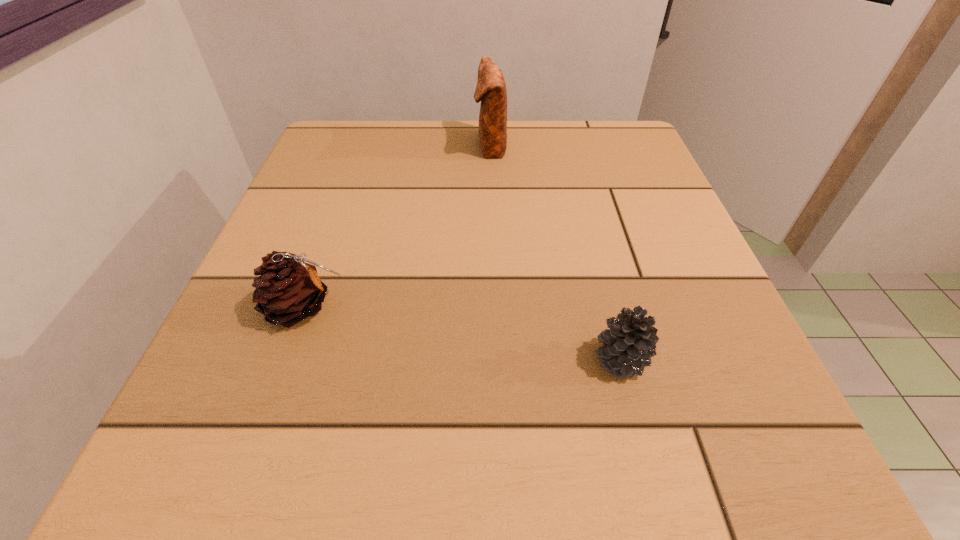
This screenshot has width=960, height=540. I want to click on vacant space located on the back of the nearer pinecone, so (575, 187).

This screenshot has height=540, width=960. Find the location of `object that is at the far edge`. object that is at the far edge is located at coordinates (491, 90).

The height and width of the screenshot is (540, 960). I want to click on object at the left edge, so click(289, 290).

Identify the location of object present at the right edge. (629, 344).

Find the location of `free space at the far edge of the desktop`. free space at the far edge of the desktop is located at coordinates (423, 173).

Locate an element on the screen. vacant space at the near edge of the desktop is located at coordinates (360, 426).

The width and height of the screenshot is (960, 540). Find the location of `blank area at the left edge`. blank area at the left edge is located at coordinates (312, 191).

Find the location of a particular element. vacant space at the right edge is located at coordinates (624, 206).

Locate an element on the screen. Image resolution: width=960 pixels, height=540 pixels. vacant space at the far left corner of the desktop is located at coordinates (369, 151).

The height and width of the screenshot is (540, 960). In the image, there is a desktop. In order to click on vacant space at the far right corner in this screenshot , I will do `click(629, 139)`.